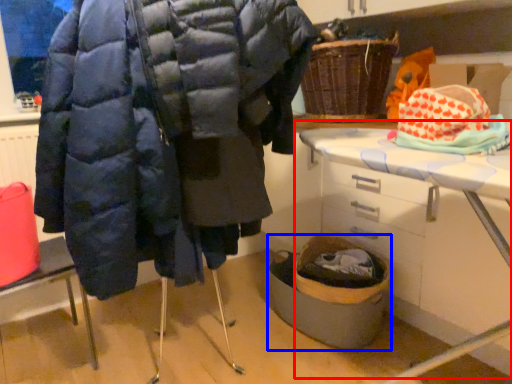
Question: Which object is further to the camera taking this photo, table (highlighted by a red box) or basket container (highlighted by a blue box)?

Choices:
 (A) table
 (B) basket container

Answer: (B)